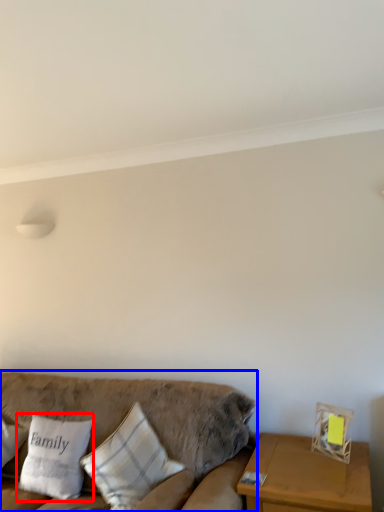
Question: Which object appears farthest to the camera in this image, pillow (highlighted by a red box) or studio couch (highlighted by a blue box)?

Choices:
 (A) pillow
 (B) studio couch

Answer: (A)